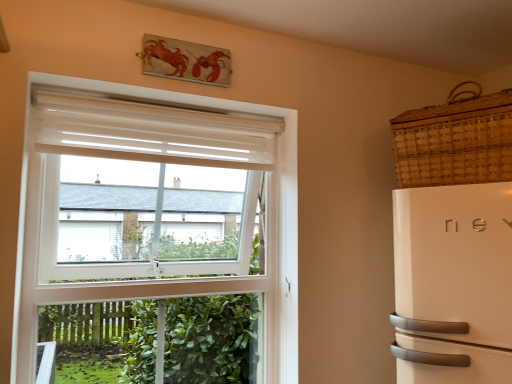
What do you see at coordinates (455, 141) in the screenshot? I see `woven brown basket at upper right` at bounding box center [455, 141].

The height and width of the screenshot is (384, 512). Identify the location of woven brown basket at upper right. (455, 141).

Image resolution: width=512 pixels, height=384 pixels. What are the coordinates of `woven brown basket at upper right` in the screenshot? It's located at [x=455, y=141].